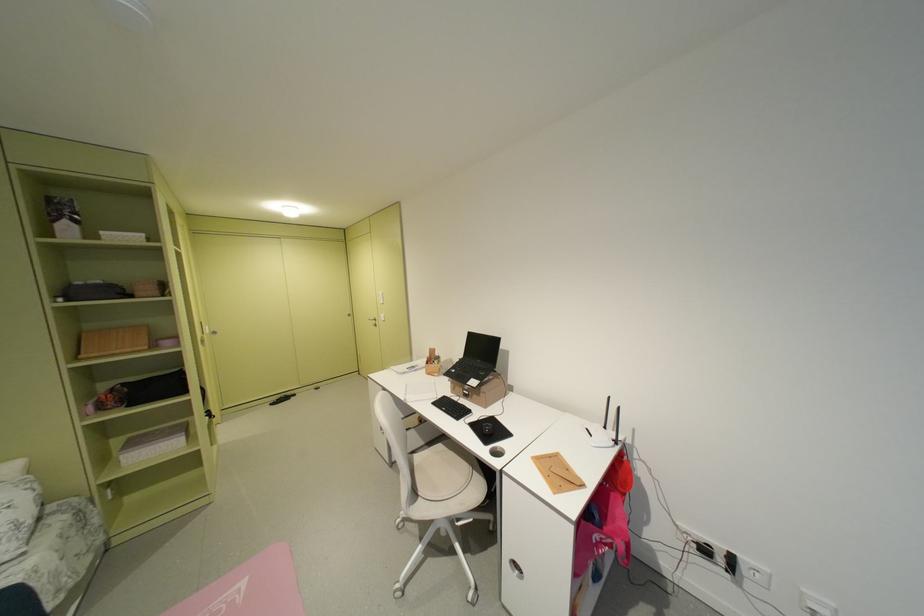
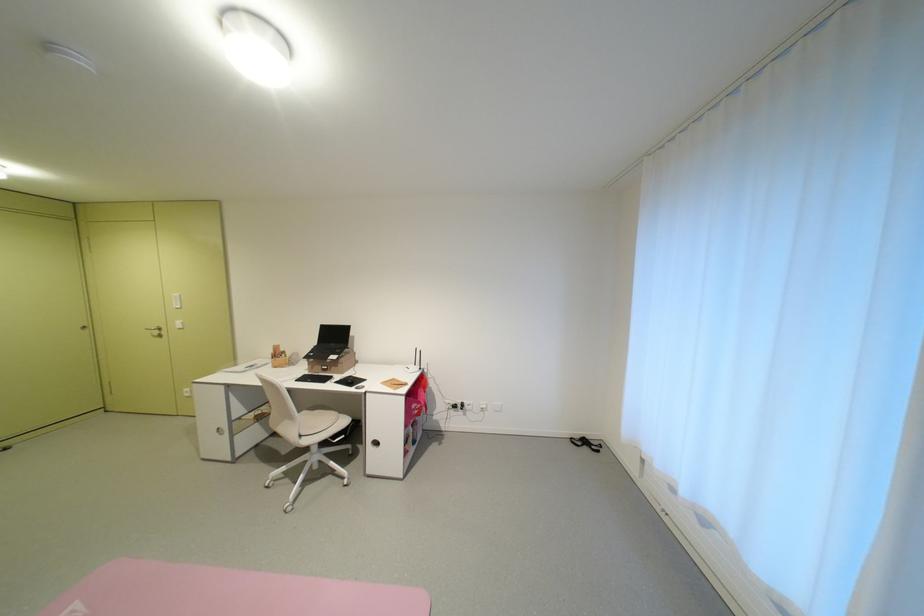
Find the pixel in the second image that matches (445,363) in the first image.

(293, 357)